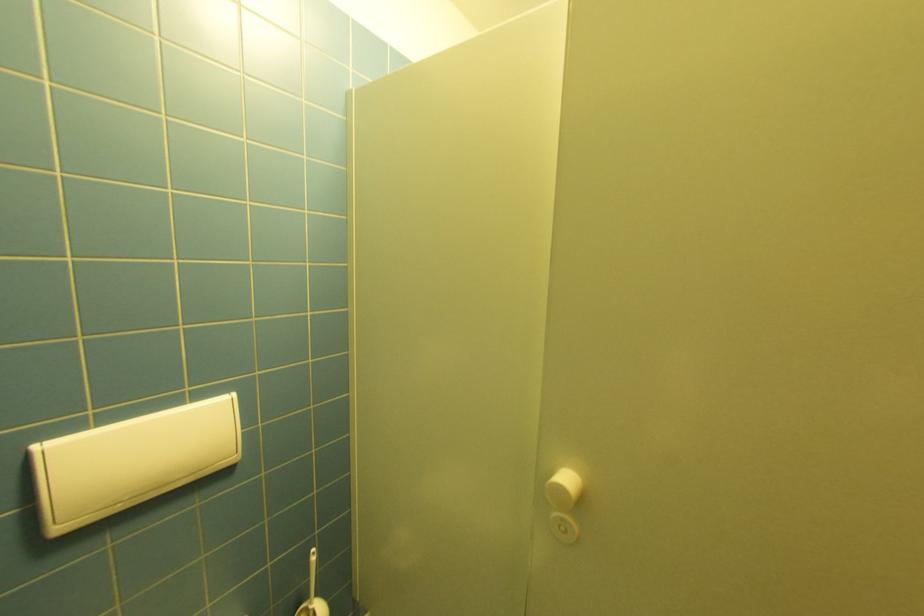
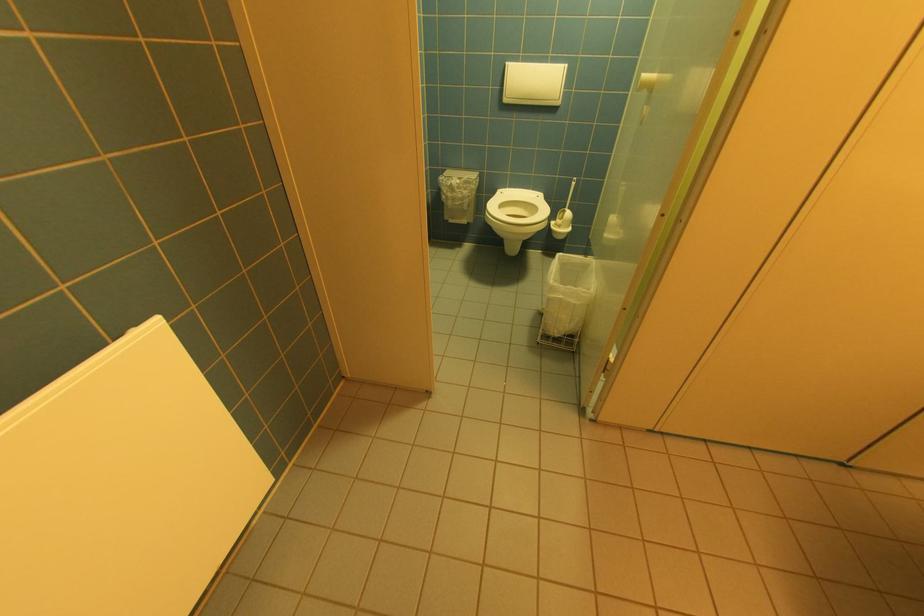
In the second image, find the point that corresponds to point (66, 530) in the first image.

(512, 100)